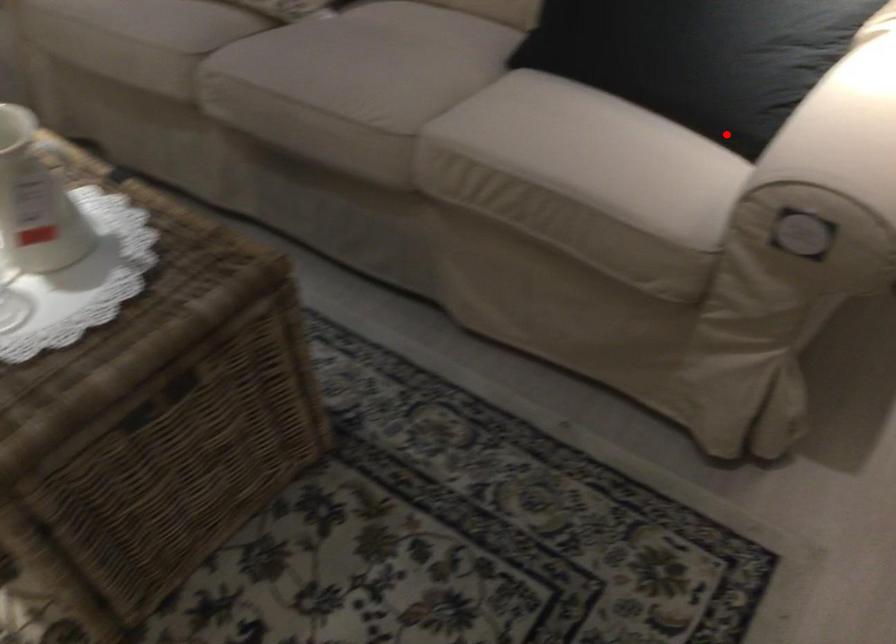
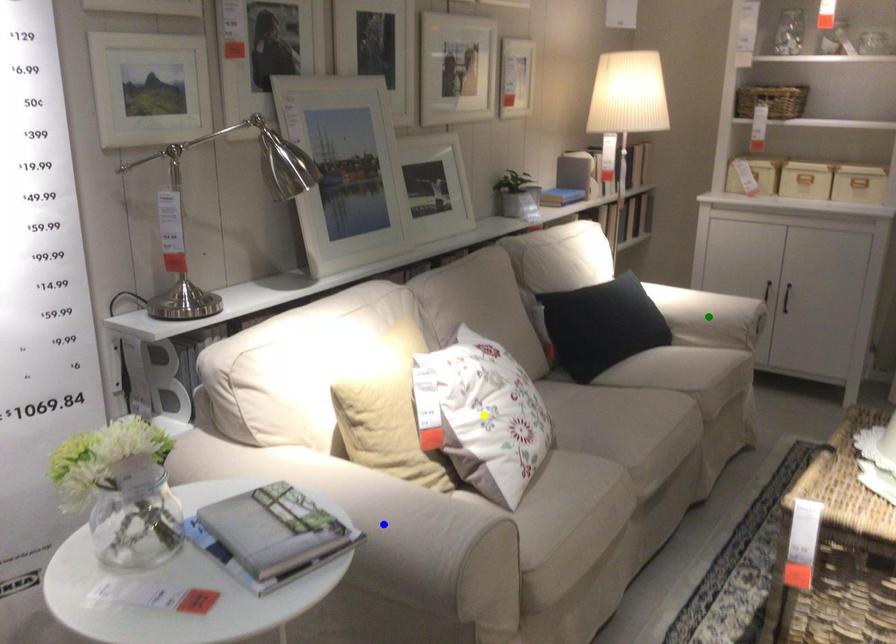
Question: I am providing you with two images of the same scene from different viewpoints. A red point is marked on the first image. You are given multiple points on the second image. Which point in image 2 is actually the same real-world point as the red point in image 1?

Choices:
 (A) yellow point
 (B) green point
 (C) blue point

Answer: (B)